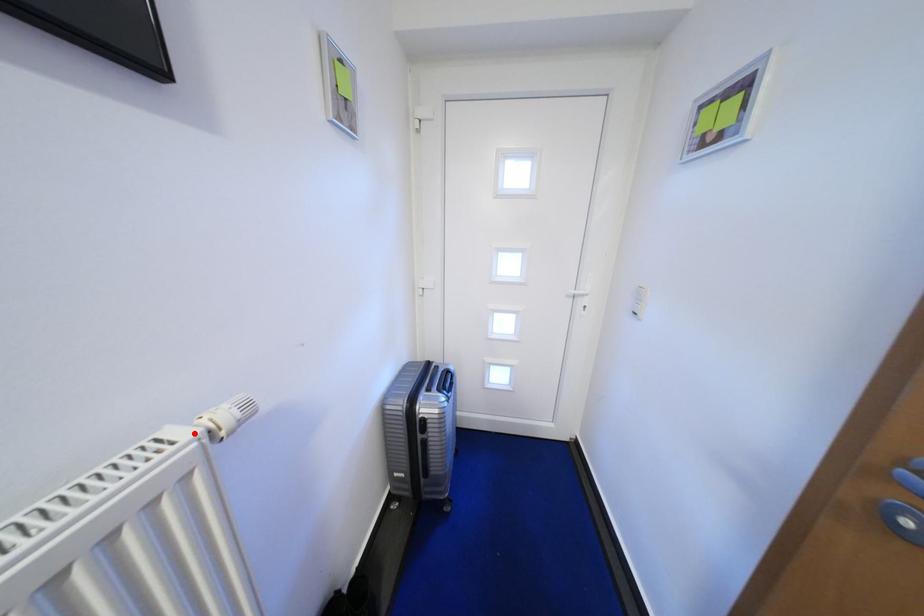
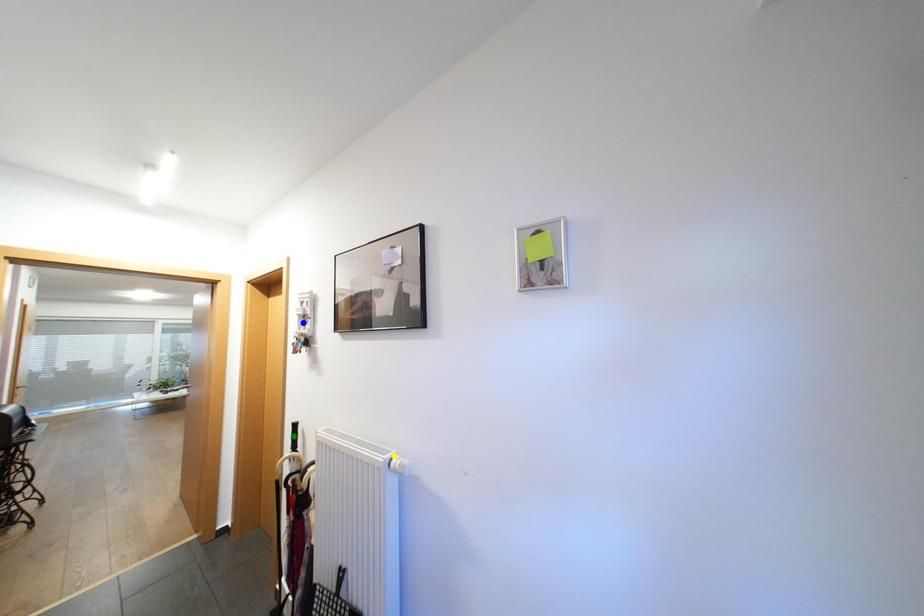
Question: I am providing you with two images of the same scene from different viewpoints. A red point is marked on the first image. You are given multiple points on the second image. Which spot in image 2 lines up with the point in image 1?

Choices:
 (A) blue point
 (B) yellow point
 (C) green point

Answer: (B)